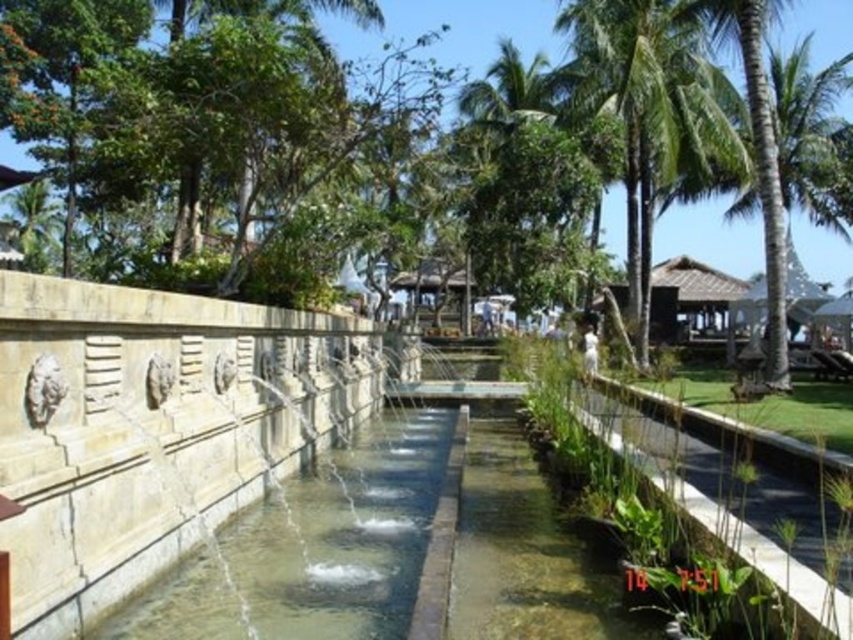
Between green leafy palm tree at upper right and green leafy palm tree at center, which one has less height?

Standing shorter between the two is green leafy palm tree at upper right.

Can you confirm if green leafy palm tree at upper right is positioned above green leafy palm tree at center?

No.

Find the location of a particular element. This screenshot has width=853, height=640. green leafy palm tree at upper right is located at coordinates (653, 113).

Can you confirm if green leafy palm tree at upper right is positioned below green leafy tree at upper center?

Indeed, green leafy palm tree at upper right is positioned under green leafy tree at upper center.

What do you see at coordinates (653, 113) in the screenshot? I see `green leafy palm tree at upper right` at bounding box center [653, 113].

The width and height of the screenshot is (853, 640). Describe the element at coordinates (653, 113) in the screenshot. I see `green leafy palm tree at upper right` at that location.

Where is `green leafy palm tree at upper right`? This screenshot has width=853, height=640. green leafy palm tree at upper right is located at coordinates (653, 113).

Which of these two, green leafy tree at upper center or green leafy palm tree at center, stands shorter?

Standing shorter between the two is green leafy palm tree at center.

Who is positioned more to the left, green leafy tree at upper center or green leafy palm tree at center?

Positioned to the left is green leafy palm tree at center.

Between point (450, 42) and point (485, 115), which one is positioned behind?

Positioned behind is point (450, 42).

The width and height of the screenshot is (853, 640). I want to click on green leafy tree at upper center, so click(x=456, y=28).